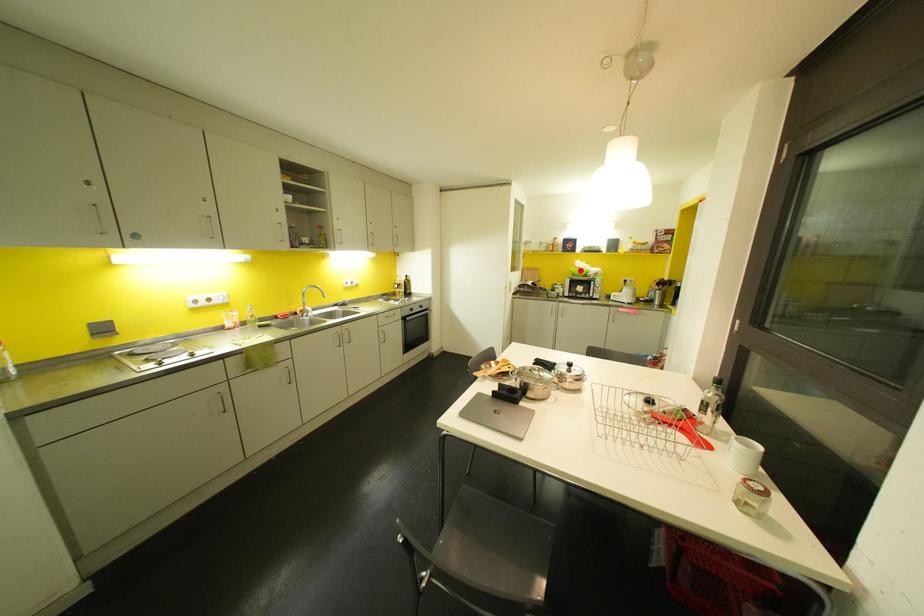
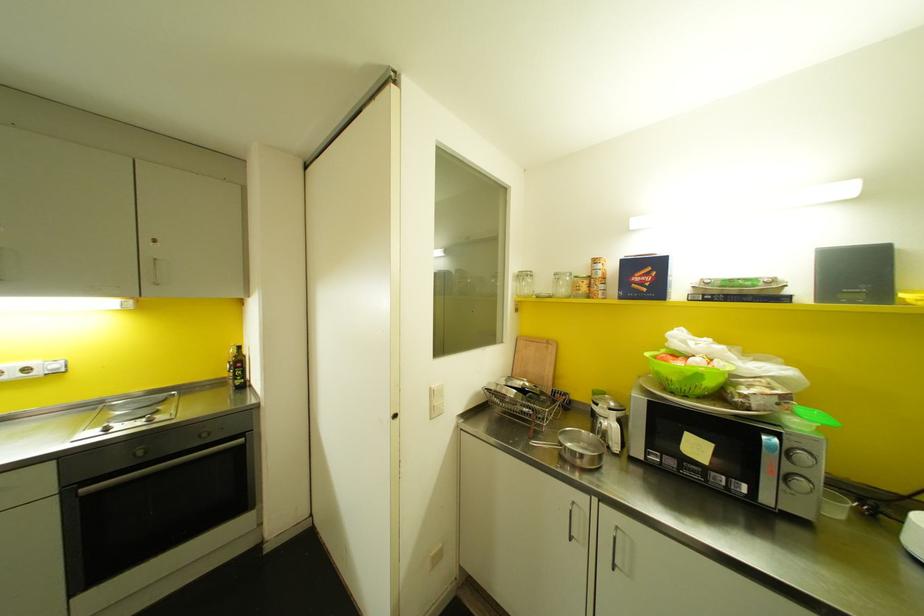
Where in the second image is the point corresponding to the highlighted location from the first image?

(698, 376)